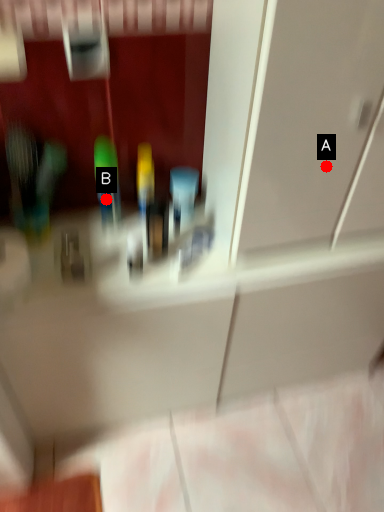
Question: Two points are circled on the image, labeled by A and B beside each circle. Which point is further to the camera?

Choices:
 (A) A is further
 (B) B is further

Answer: (B)